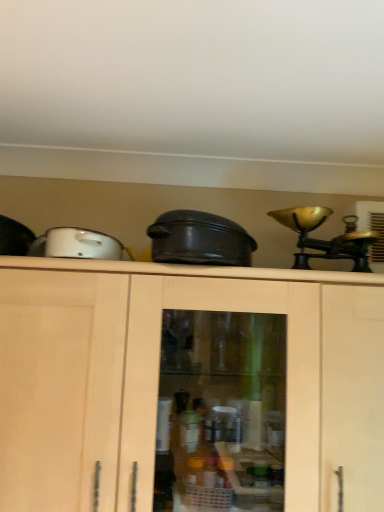
What do you see at coordinates (199, 240) in the screenshot? I see `black matte crock pot at center` at bounding box center [199, 240].

Where is `black matte crock pot at center`? black matte crock pot at center is located at coordinates (199, 240).

In order to face black matte crock pot at center, should I rotate leftwards or rightwards?

You should look right and rotate roughly 1.603 degrees.

You are a GUI agent. You are given a task and a screenshot of the screen. Output one action in this format:
    pyautogui.click(x=<x>, y=<y>)
    Task: Click on the white glossy toaster at upper left
    This screenshot has height=512, width=384.
    Given the screenshot: What is the action you would take?
    pos(76,244)

Describe the element at coordinates (76, 244) in the screenshot. I see `white glossy toaster at upper left` at that location.

The width and height of the screenshot is (384, 512). I want to click on black matte crock pot at center, so click(199, 240).

Does black matte crock pot at center appear on the right side of white glossy toaster at upper left?

Indeed, black matte crock pot at center is positioned on the right side of white glossy toaster at upper left.

Does black matte crock pot at center come behind white glossy toaster at upper left?

Yes, black matte crock pot at center is behind white glossy toaster at upper left.

Considering the points (162, 228) and (120, 259), which point is in front, point (162, 228) or point (120, 259)?

Positioned in front is point (162, 228).

From the image's perspective, is black matte crock pot at center under white glossy toaster at upper left?

Yes.

From a real-world perspective, which object stands above the other?

In real-world perspective, black matte crock pot at center is above.

Considering the relative sizes of black matte crock pot at center and white glossy toaster at upper left in the image provided, is black matte crock pot at center wider than white glossy toaster at upper left?

Correct, the width of black matte crock pot at center exceeds that of white glossy toaster at upper left.

Who is taller, black matte crock pot at center or white glossy toaster at upper left?

With more height is black matte crock pot at center.

Looking at the image, does black matte crock pot at center seem bigger or smaller compared to white glossy toaster at upper left?

black matte crock pot at center is bigger than white glossy toaster at upper left.

Is black matte crock pot at center spatially inside white glossy toaster at upper left, or outside of it?

black matte crock pot at center cannot be found inside white glossy toaster at upper left.

Is black matte crock pot at center not close to white glossy toaster at upper left?

No, black matte crock pot at center is not far away from white glossy toaster at upper left.

Is black matte crock pot at center positioned with its back to white glossy toaster at upper left?

That's not correct — black matte crock pot at center is not looking away from white glossy toaster at upper left.

What's the angular difference between black matte crock pot at center and white glossy toaster at upper left's facing directions?

The angular difference between black matte crock pot at center and white glossy toaster at upper left is 1.39 degrees.

Where is `appliance in front of the black matte crock pot at center`? The width and height of the screenshot is (384, 512). appliance in front of the black matte crock pot at center is located at coordinates (76, 244).

Is white glossy toaster at upper left to the right of black matte crock pot at center from the viewer's perspective?

In fact, white glossy toaster at upper left is to the left of black matte crock pot at center.

Is white glossy toaster at upper left in front of or behind black matte crock pot at center in the image?

Clearly, white glossy toaster at upper left is in front of black matte crock pot at center.

Between point (111, 250) and point (154, 231), which one is positioned behind?

The point (111, 250) is more distant.

From the image's perspective, relative to black matte crock pot at center, is white glossy toaster at upper left above or below?

Based on their image positions, white glossy toaster at upper left is located above black matte crock pot at center.

From a real-world perspective, who is located higher, white glossy toaster at upper left or black matte crock pot at center?

black matte crock pot at center, from a real-world perspective.

Can you confirm if white glossy toaster at upper left is wider than black matte crock pot at center?

In fact, white glossy toaster at upper left might be narrower than black matte crock pot at center.

Is white glossy toaster at upper left taller than black matte crock pot at center?

Incorrect, the height of white glossy toaster at upper left is not larger of that of black matte crock pot at center.

Considering the sizes of white glossy toaster at upper left and black matte crock pot at center in the image, is white glossy toaster at upper left bigger or smaller than black matte crock pot at center?

white glossy toaster at upper left is smaller than black matte crock pot at center.

Would you say white glossy toaster at upper left contains black matte crock pot at center?

No, black matte crock pot at center is not inside white glossy toaster at upper left.

Is white glossy toaster at upper left not near black matte crock pot at center?

No, white glossy toaster at upper left is not far from black matte crock pot at center.

Is white glossy toaster at upper left facing away from black matte crock pot at center?

No, black matte crock pot at center is not at the back of white glossy toaster at upper left.

In the scene shown: How many degrees apart are the facing directions of white glossy toaster at upper left and black matte crock pot at center?

white glossy toaster at upper left and black matte crock pot at center are facing 1.39 degrees away from each other.

This screenshot has height=512, width=384. I want to click on appliance on the left of black matte crock pot at center, so [76, 244].

What are the coordinates of `appliance on the left of black matte crock pot at center` in the screenshot? It's located at (76, 244).

You are a GUI agent. You are given a task and a screenshot of the screen. Output one action in this format:
    pyautogui.click(x=<x>, y=<y>)
    Task: Click on the crock pot above the white glossy toaster at upper left (from a real-world perspective)
    The width and height of the screenshot is (384, 512).
    Given the screenshot: What is the action you would take?
    pyautogui.click(x=199, y=240)